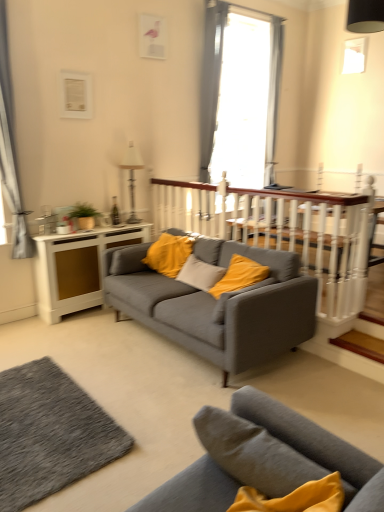
Identify the location of free area behind textured gray rug at lower left. (88, 348).